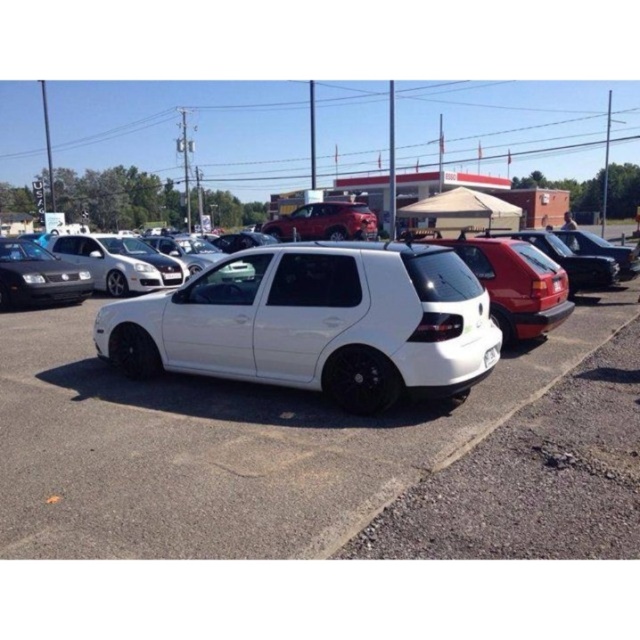
Question: Which point is closer to the camera?

Choices:
 (A) matte black car at left
 (B) white glossy hatchback at center
 (C) shiny red suv at center
 (D) glossy red hatchback at center

Answer: (B)

Question: Which point is closer to the camera?

Choices:
 (A) glossy red hatchback at center
 (B) white glossy hatchback at center
 (C) shiny red suv at center

Answer: (B)

Question: Does glossy red hatchback at center have a smaller size compared to matte black car at left?

Choices:
 (A) yes
 (B) no

Answer: (A)

Question: Which point is farther to the camera?

Choices:
 (A) (368, 442)
 (B) (339, 230)
 (C) (531, 248)
 (D) (492, 336)

Answer: (B)

Question: Observing the image, what is the correct spatial positioning of white glossy hatchback at center in reference to white matte hatchback at center?

Choices:
 (A) below
 (B) above

Answer: (A)

Question: Is white matte hatchback at center to the right of satin black hatchback at right from the viewer's perspective?

Choices:
 (A) yes
 (B) no

Answer: (B)